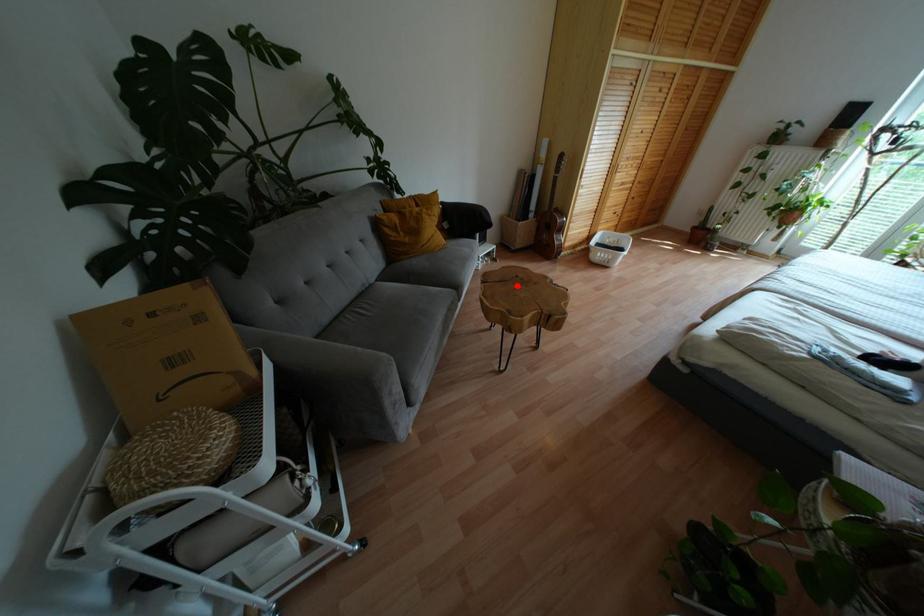
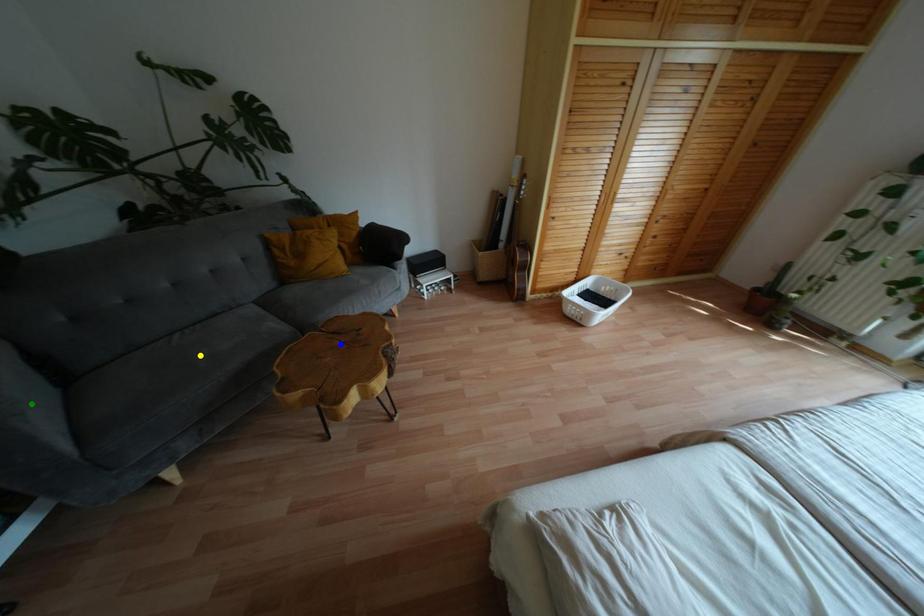
Question: I am providing you with two images of the same scene from different viewpoints. A red point is marked on the first image. You are given multiple points on the second image. Which spot in image 2 lines up with the point in image 1?

Choices:
 (A) blue point
 (B) green point
 (C) yellow point

Answer: (A)